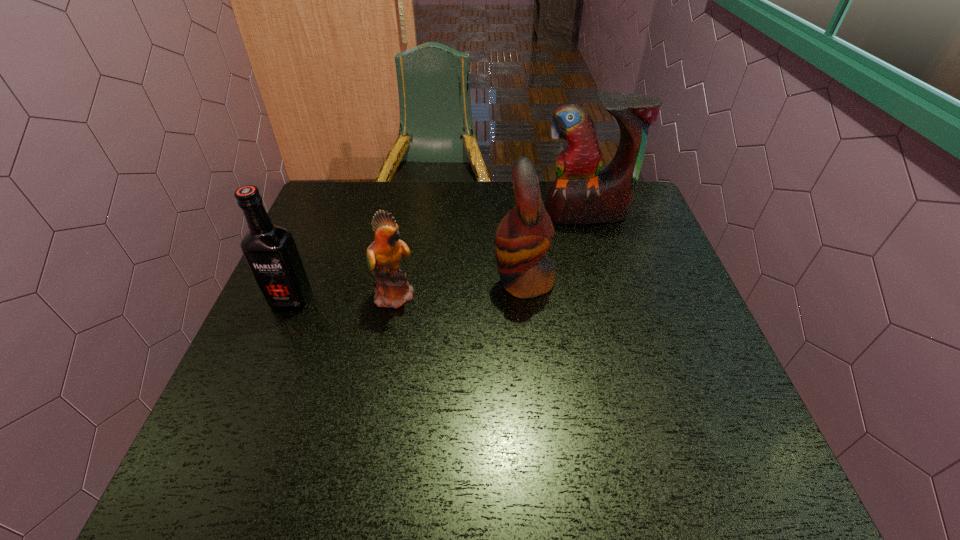
Where is `object that is positioned at the far right corner`? This screenshot has height=540, width=960. object that is positioned at the far right corner is located at coordinates pos(581,194).

Find the location of a particular element. Image resolution: width=960 pixels, height=540 pixels. free space at the far edge of the desktop is located at coordinates (451, 224).

The image size is (960, 540). In the image, there is a desktop. In order to click on free region at the near edge in this screenshot , I will do `click(387, 463)`.

Find the location of a particular element. The image size is (960, 540). vacant space at the right edge of the desktop is located at coordinates (661, 273).

In the image, there is a desktop. In order to click on vacant area at the far left corner in this screenshot , I will do `click(371, 194)`.

Locate an element on the screen. vacant area at the far right corner of the desktop is located at coordinates (640, 205).

Locate an element on the screen. free space at the near right corner is located at coordinates (739, 448).

The image size is (960, 540). I want to click on free space between the second object from left to right and the liquor, so click(344, 298).

Image resolution: width=960 pixels, height=540 pixels. I want to click on blank region between the shortest object and the farthest object, so click(491, 254).

Locate an element on the screen. The image size is (960, 540). free space between the farthest parrot and the shortest object is located at coordinates (491, 254).